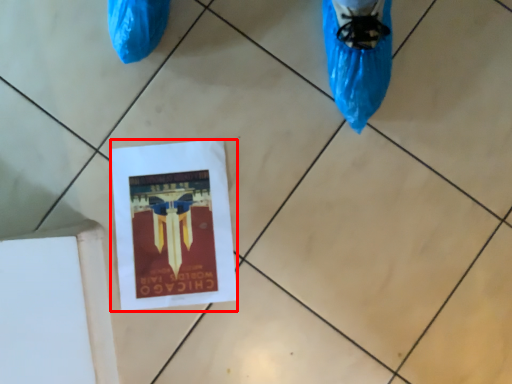
Question: Where is flyer (annotated by the red box) located in relation to tile in the image?

Choices:
 (A) right
 (B) left

Answer: (B)